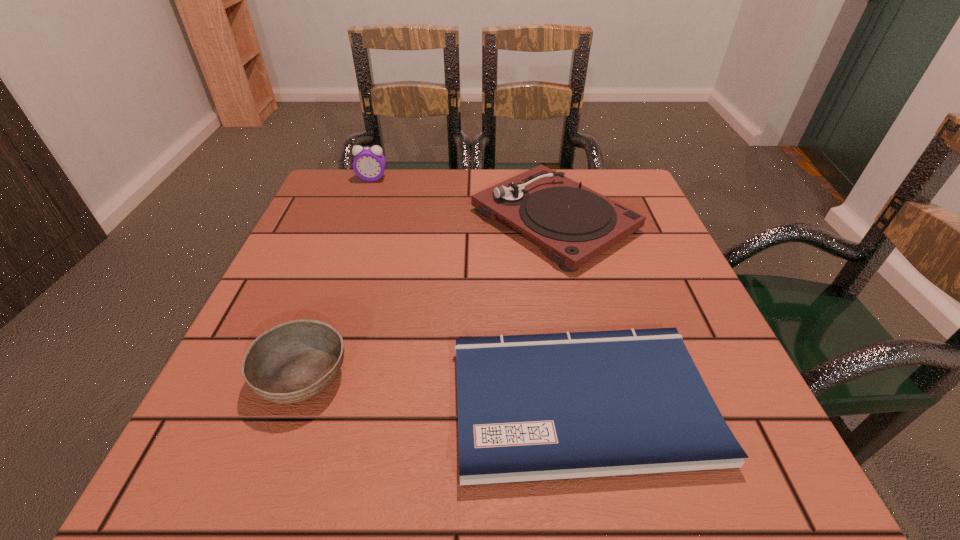
The image size is (960, 540). Find the location of `the tallest object`. the tallest object is located at coordinates (369, 164).

The width and height of the screenshot is (960, 540). Find the location of `phonograph_record`. phonograph_record is located at coordinates (575, 224).

Identify the location of the third tallest object. (294, 361).

Where is `paperback book`? paperback book is located at coordinates (536, 407).

Locate an element on the screen. free location located on the face of the tallest object is located at coordinates (366, 196).

Image resolution: width=960 pixels, height=540 pixels. I want to click on vacant space located on the left of the third shortest object, so click(x=303, y=220).

Where is `vacant area situated on the left of the bowl`? Image resolution: width=960 pixels, height=540 pixels. vacant area situated on the left of the bowl is located at coordinates (226, 376).

Find the location of a particular element. The height and width of the screenshot is (540, 960). free space located on the back of the shortest object is located at coordinates (544, 215).

Where is `alarm clock that is at the far edge`? This screenshot has height=540, width=960. alarm clock that is at the far edge is located at coordinates (369, 164).

You are a GUI agent. You are given a task and a screenshot of the screen. Output one action in this format:
    pyautogui.click(x=<x>, y=<y>)
    Task: Click on the phonograph_record that is at the far edge
    
    Given the screenshot: What is the action you would take?
    pyautogui.click(x=575, y=224)